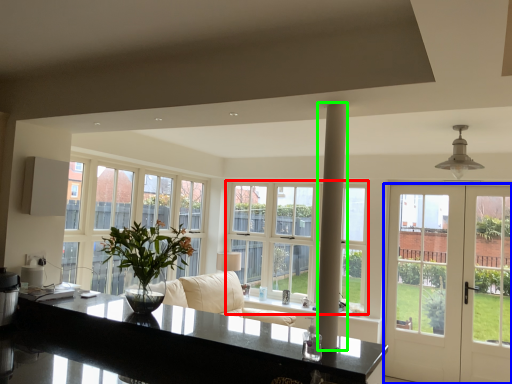
Question: Based on their relative distances, which object is farther from window (highlighted by a red box)? Choose from door (highlighted by a blue box) and pillar (highlighted by a green box).

Choices:
 (A) door
 (B) pillar

Answer: (B)